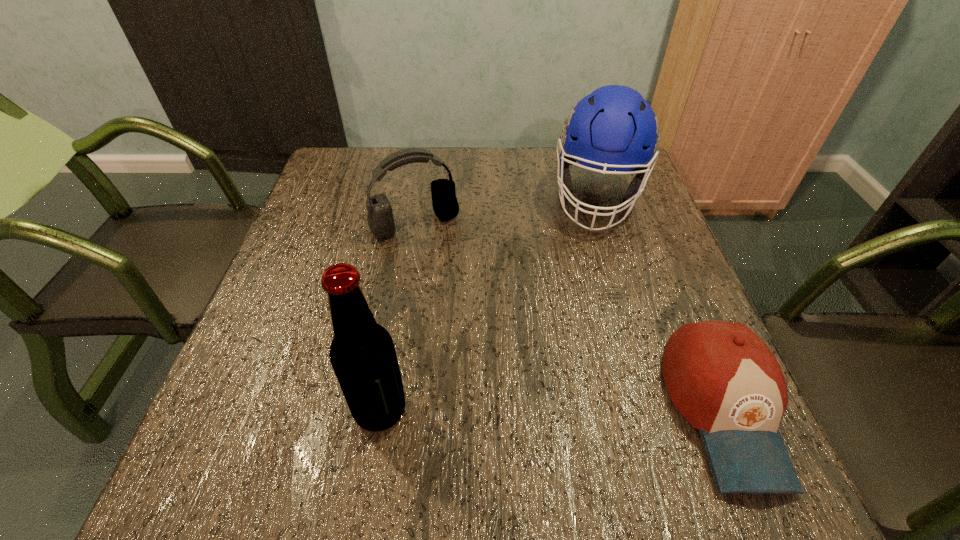
Locate an element on the screen. free space between the baseball cap and the football helmet is located at coordinates (660, 304).

Image resolution: width=960 pixels, height=540 pixels. I want to click on free area in between the shortest object and the beer bottle, so click(552, 410).

The image size is (960, 540). I want to click on free area in between the headset and the second tallest object, so click(x=507, y=211).

Where is `the second closest object to the football helmet`? the second closest object to the football helmet is located at coordinates (723, 379).

Locate an element on the screen. Image resolution: width=960 pixels, height=540 pixels. the closest object to the football helmet is located at coordinates (380, 219).